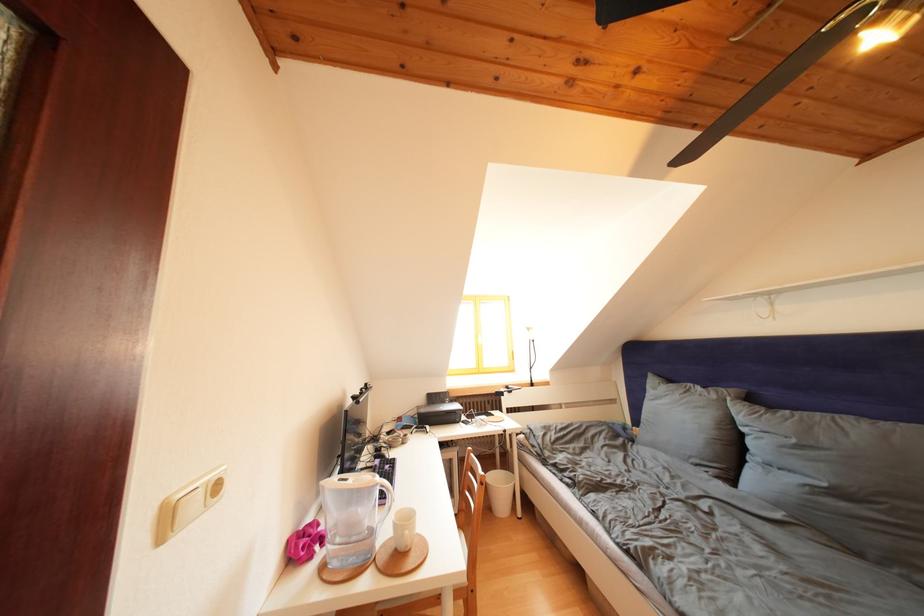
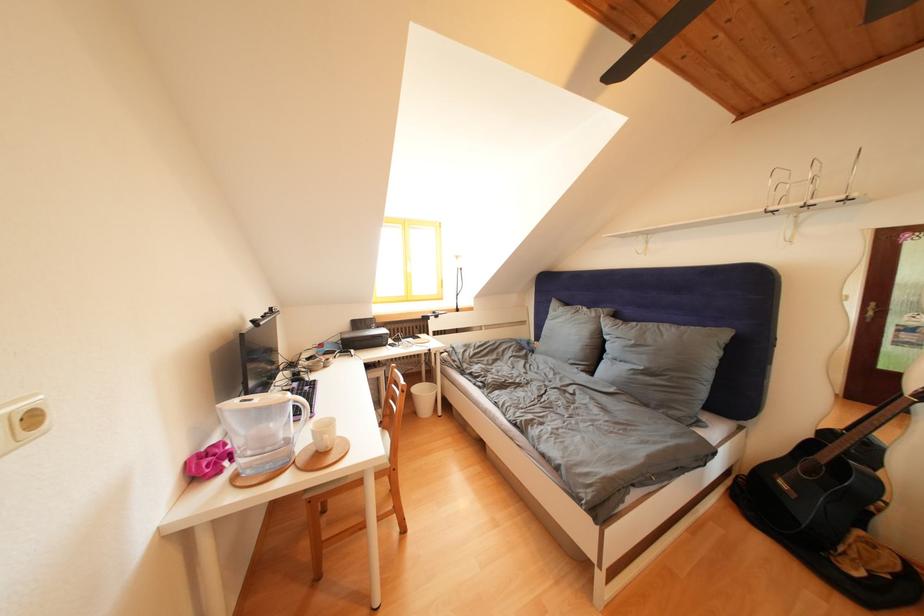
In the second image, find the point that corresponds to (x=677, y=386) in the first image.

(575, 310)